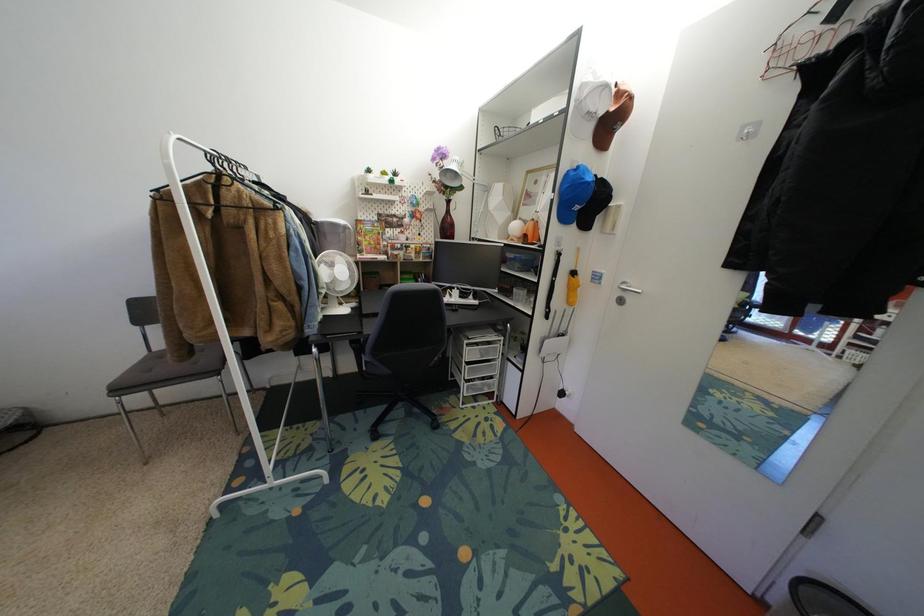
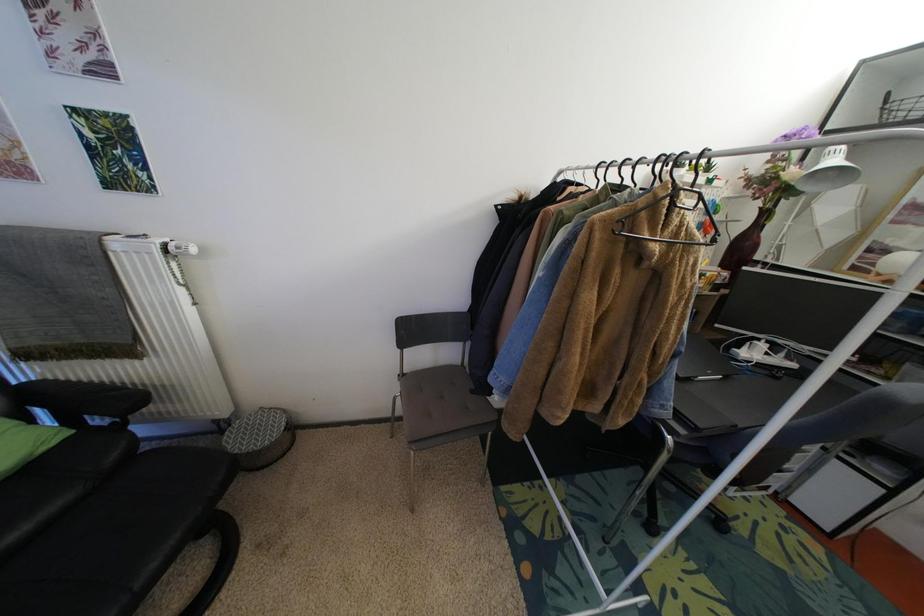
Question: The images are taken continuously from a first-person perspective. In which direction are you moving?

Choices:
 (A) Left
 (B) Right
 (C) Forward
 (D) Backward

Answer: (A)